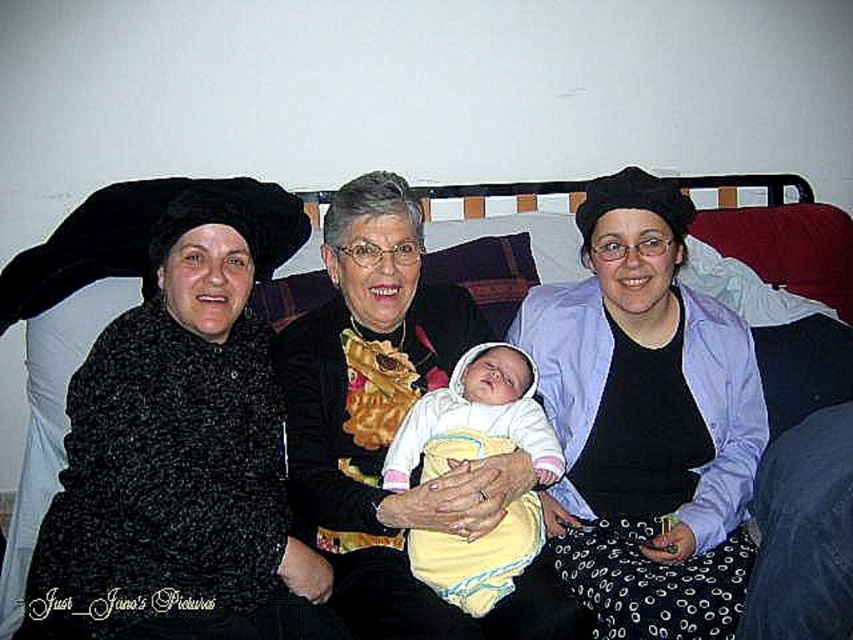
Question: Which object is farther from the camera taking this photo?

Choices:
 (A) yellow fleece baby at center
 (B) matte black coat at left

Answer: (B)

Question: Is matte black beret at center closer to camera compared to matte black coat at left?

Choices:
 (A) yes
 (B) no

Answer: (A)

Question: Which of the following is the closest to the observer?

Choices:
 (A) matte black beret at center
 (B) matte black coat at left
 (C) yellow fleece baby at center

Answer: (A)

Question: Observing the image, what is the correct spatial positioning of matte black coat at left in reference to yellow fleece baby at center?

Choices:
 (A) left
 (B) right

Answer: (A)

Question: Which point is closer to the camera?

Choices:
 (A) yellow fleece baby at center
 (B) matte black beret at center

Answer: (B)

Question: Can you confirm if matte black coat at left is bigger than yellow fleece baby at center?

Choices:
 (A) yes
 (B) no

Answer: (A)